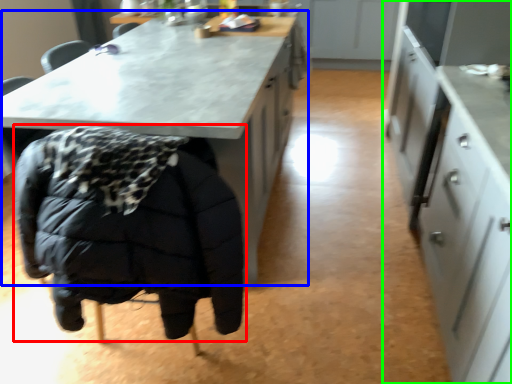
Question: Which object is the farthest from jacket (highlighted by a red box)? Choose among these: table (highlighted by a blue box) or cabinetry (highlighted by a green box).

Choices:
 (A) table
 (B) cabinetry

Answer: (B)